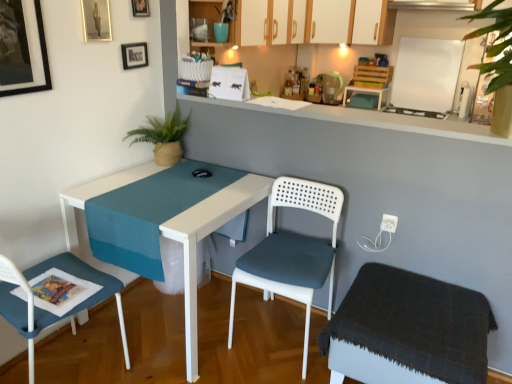
Question: Relative to matte black picture frame at upper left, which is the 1th picture frame from back to front, is white plastic chair at center, which appears as the 2th chair when viewed from the left, in front or behind?

Choices:
 (A) front
 (B) behind

Answer: (A)

Question: Based on their positions, is white plastic chair at center, which is the 1th chair in right-to-left order, located to the left or right of matte black picture frame at upper left, arranged as the fourth picture frame when viewed from the front?

Choices:
 (A) right
 (B) left

Answer: (A)

Question: Which object is the closest to the matte gold picture frame at upper left, the 2th picture frame when ordered from left to right?

Choices:
 (A) green woven plant at upper left
 (B) metallic gold picture frame at upper center, which appears as the 3th picture frame when viewed from the front
 (C) matte white cabinet at upper center, which is counted as the 3th cabinetry, starting from the back
 (D) dark gray fabric stool at lower right
 (E) teal fabric at upper center

Answer: (B)

Question: Estimate the real-world distances between objects in this image. Which object is farther from the white plastic table at center?

Choices:
 (A) blue fabric chair at lower left, the first chair from the left
 (B) matte white cabinet at upper center, which is counted as the 3th cabinetry, starting from the back
 (C) matte black picture frame at upper left, arranged as the fourth picture frame when viewed from the front
 (D) white matte cabinet at upper center, which is counted as the 3th cabinetry, starting from the front
 (E) green woven plant at upper left

Answer: (D)